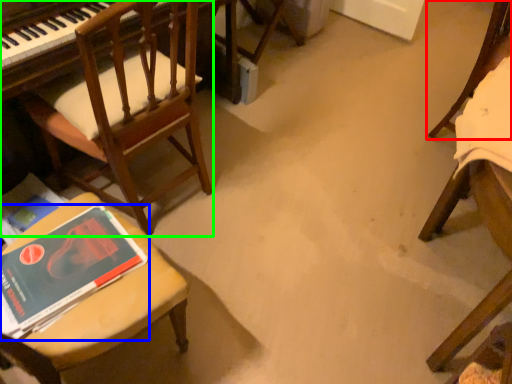
Question: Based on their relative distances, which object is nearer to chair (highlighted by a red box)? Choose from book (highlighted by a blue box) and chair (highlighted by a green box).

Choices:
 (A) book
 (B) chair

Answer: (B)